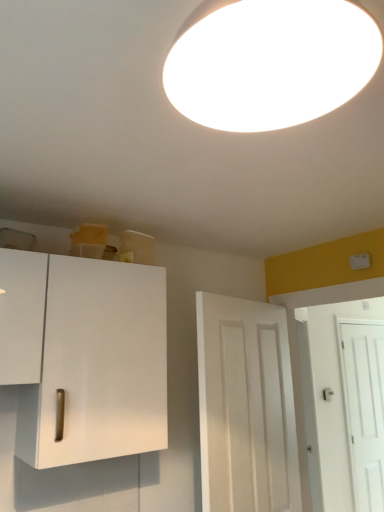
Question: Considering the relative sizes of white smooth door at center, which is the 3th door in back-to-front order, and white matte door at right, which is the 1th door in back-to-front order, in the image provided, is white smooth door at center, which is the 3th door in back-to-front order, smaller than white matte door at right, which is the 1th door in back-to-front order,?

Choices:
 (A) no
 (B) yes

Answer: (A)

Question: From the image's perspective, is white smooth door at center, placed as the 3th door when sorted from right to left, located beneath white matte door at right, the third door in the front-to-back sequence?

Choices:
 (A) no
 (B) yes

Answer: (A)

Question: Would you say white matte door at right, which is the 1th door in back-to-front order, is part of white smooth door at center, which is the 3th door in back-to-front order,'s contents?

Choices:
 (A) no
 (B) yes

Answer: (A)

Question: Can you confirm if white smooth door at center, placed as the 3th door when sorted from right to left, is wider than white matte door at right, the third door in the front-to-back sequence?

Choices:
 (A) no
 (B) yes

Answer: (B)

Question: Is white smooth door at center, placed as the first door when sorted from left to right, facing towards white matte door at right, the third door in the front-to-back sequence?

Choices:
 (A) yes
 (B) no

Answer: (B)

Question: Does white matte cabinet at left have a lesser height compared to white matte door at right, the 2th door viewed from the right?

Choices:
 (A) yes
 (B) no

Answer: (A)

Question: Is white matte cabinet at left closer to camera compared to white matte door at right, which ranks as the 2th door in left-to-right order?

Choices:
 (A) no
 (B) yes

Answer: (B)

Question: Considering the relative positions of white matte cabinet at left and white matte door at right, the 2th door when ordered from front to back, in the image provided, is white matte cabinet at left to the right of white matte door at right, the 2th door when ordered from front to back, from the viewer's perspective?

Choices:
 (A) yes
 (B) no

Answer: (B)

Question: From the image's perspective, does white matte cabinet at left appear higher than white matte door at right, the 2th door viewed from the right?

Choices:
 (A) yes
 (B) no

Answer: (A)

Question: Is white matte cabinet at left facing away from white matte door at right, which ranks as the second door in back-to-front order?

Choices:
 (A) yes
 (B) no

Answer: (B)

Question: Considering the relative sizes of white matte cabinet at left and white matte door at right, which ranks as the 2th door in left-to-right order, in the image provided, is white matte cabinet at left bigger than white matte door at right, which ranks as the 2th door in left-to-right order,?

Choices:
 (A) no
 (B) yes

Answer: (B)

Question: Does white matte cabinet at left have a larger size compared to white matte light fixture at upper center?

Choices:
 (A) yes
 (B) no

Answer: (A)